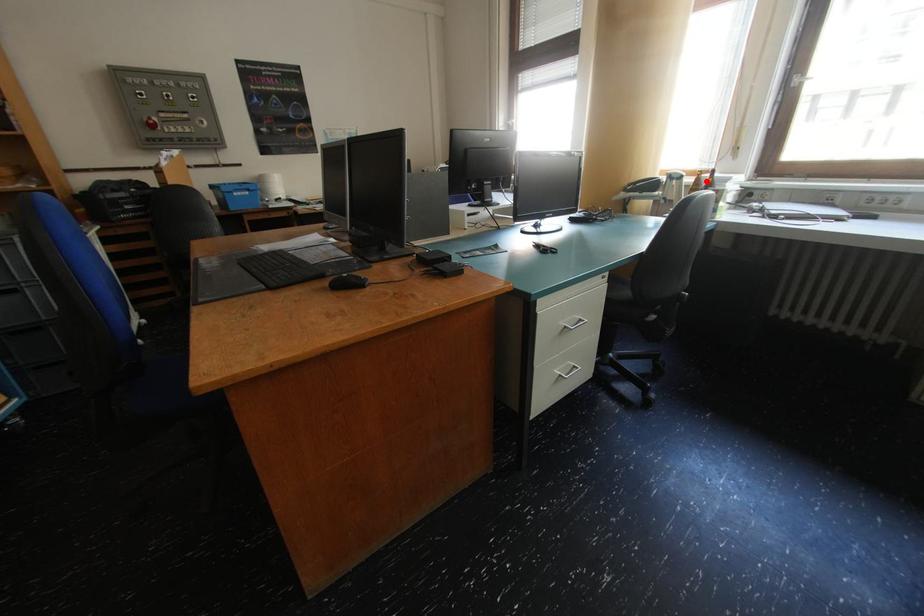
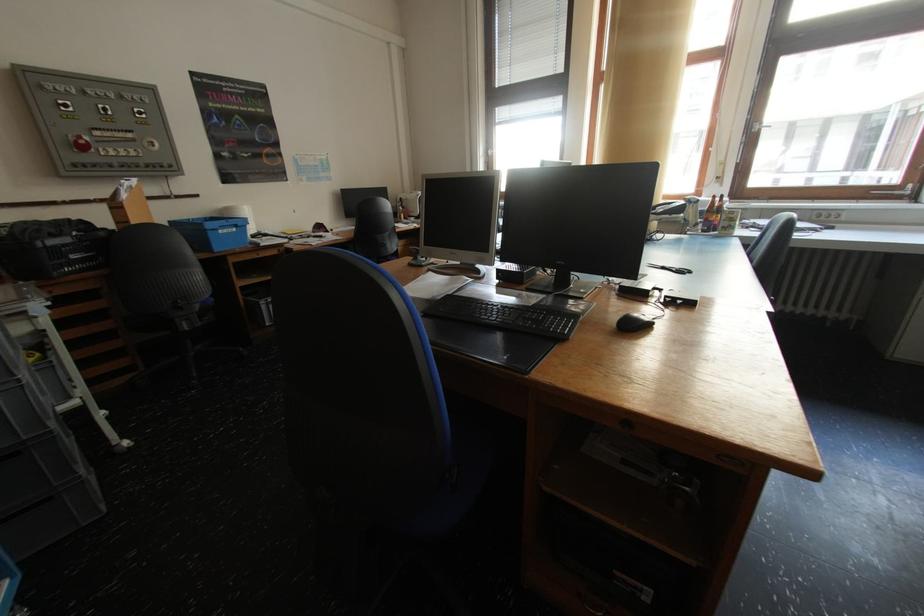
Locate, in the second image, the point that corresponds to the highlighted location in the first image.

(721, 205)